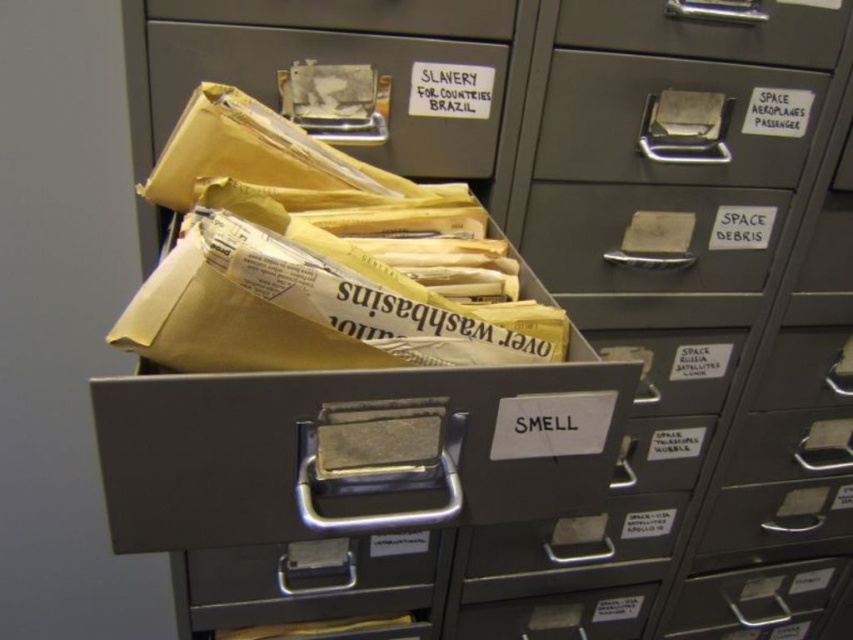
Is the position of metallic gray drawer at upper right less distant than that of metallic gray drawer at upper center?

No, metallic gray drawer at upper right is behind metallic gray drawer at upper center.

In the scene shown: Which of these two, metallic gray drawer at upper right or metallic gray drawer at upper center, stands taller?

metallic gray drawer at upper right is taller.

Find the location of a particular element. The image size is (853, 640). metallic gray drawer at upper right is located at coordinates (674, 120).

Is point (498, 81) positioned behind point (421, 20)?

Yes.

Does point (175, 28) lie behind point (428, 20)?

No, (175, 28) is closer to viewer.

Where is `matte cardboard drawer at upper center`? This screenshot has width=853, height=640. matte cardboard drawer at upper center is located at coordinates (329, 61).

Does metallic gray drawer at center have a larger size compared to matte cardboard drawer at upper center?

Incorrect, metallic gray drawer at center is not larger than matte cardboard drawer at upper center.

Does metallic gray drawer at center have a lesser height compared to matte cardboard drawer at upper center?

No, metallic gray drawer at center is not shorter than matte cardboard drawer at upper center.

Is point (700, 278) farther from viewer compared to point (265, 77)?

Yes, it is behind point (265, 77).

Where is `metallic gray drawer at center`? The image size is (853, 640). metallic gray drawer at center is located at coordinates (651, 237).